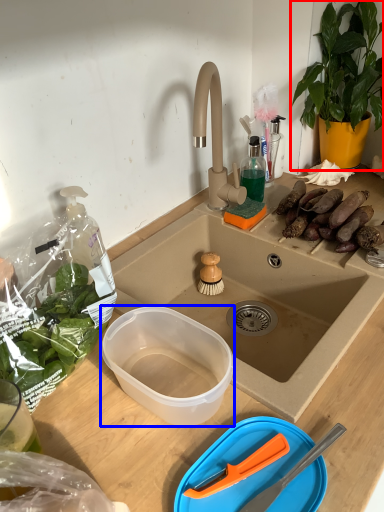
Question: Among these objects, which one is farthest to the camera, houseplant (highlighted by a red box) or bowl (highlighted by a blue box)?

Choices:
 (A) houseplant
 (B) bowl

Answer: (A)